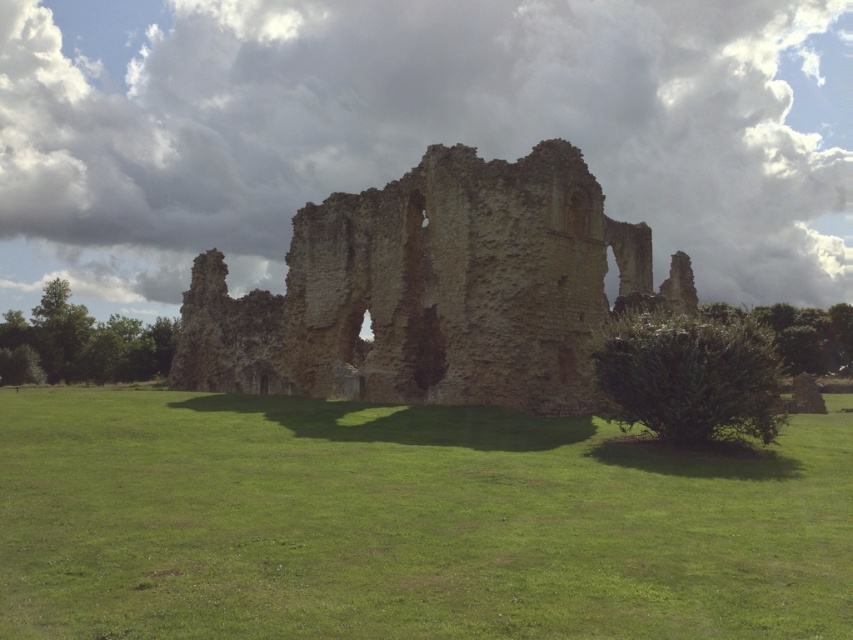
Between green grass at center and weathered stone castle at center, which one has more height?

Standing taller between the two is weathered stone castle at center.

Does point (28, 513) come closer to viewer compared to point (492, 224)?

That is True.

Find the location of a particular element. This screenshot has width=853, height=640. green grass at center is located at coordinates (405, 524).